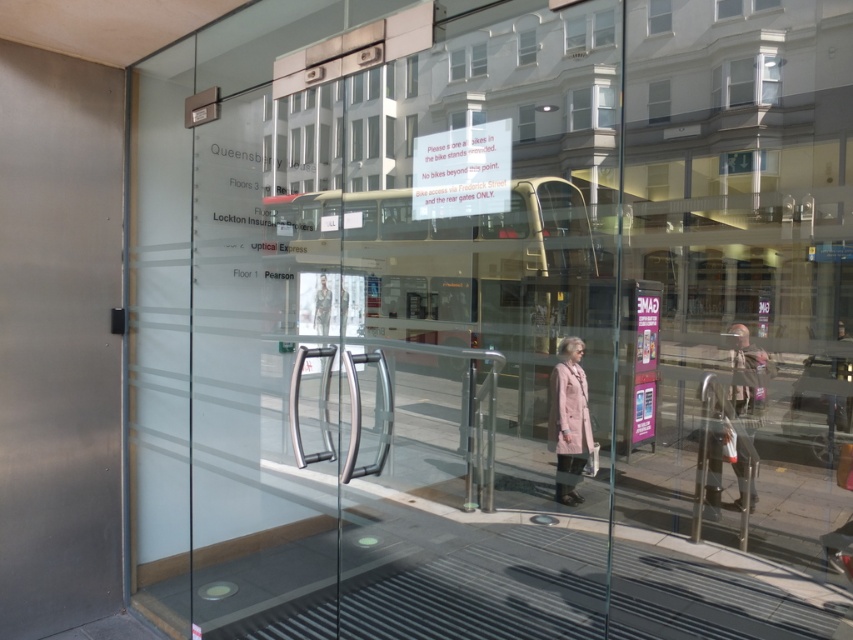
Question: Is light brown leather jacket at right thinner than light pink wool coat at center?

Choices:
 (A) no
 (B) yes

Answer: (A)

Question: Which point appears closest to the camera in this image?

Choices:
 (A) (567, 435)
 (B) (730, 390)

Answer: (A)

Question: Which point appears closest to the camera in this image?

Choices:
 (A) (561, 368)
 (B) (735, 362)

Answer: (A)

Question: Does light brown leather jacket at right appear on the right side of light pink wool coat at center?

Choices:
 (A) no
 (B) yes

Answer: (B)

Question: Considering the relative positions of light brown leather jacket at right and light pink wool coat at center in the image provided, where is light brown leather jacket at right located with respect to light pink wool coat at center?

Choices:
 (A) right
 (B) left

Answer: (A)